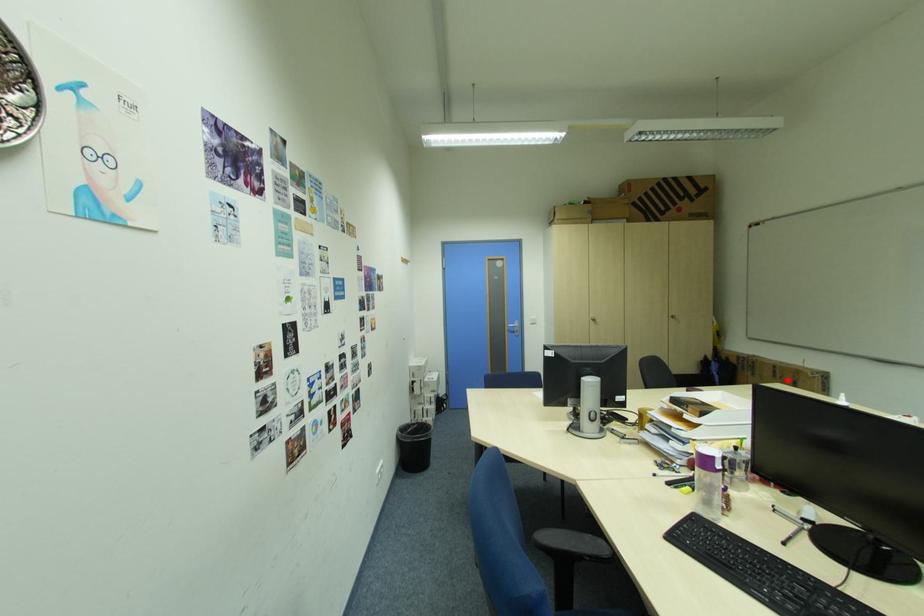
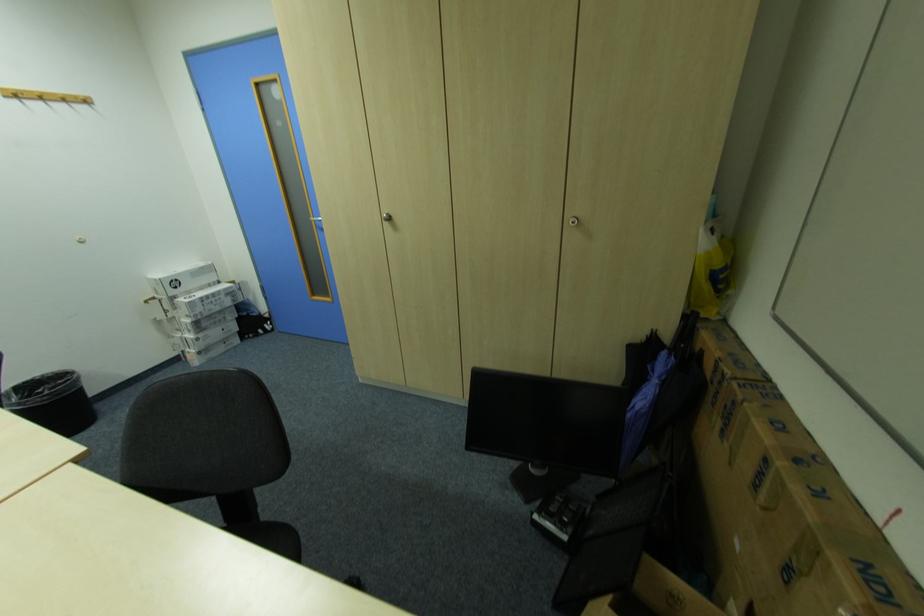
In the second image, find the point that corresponds to the highlighted location in the first image.

(772, 509)